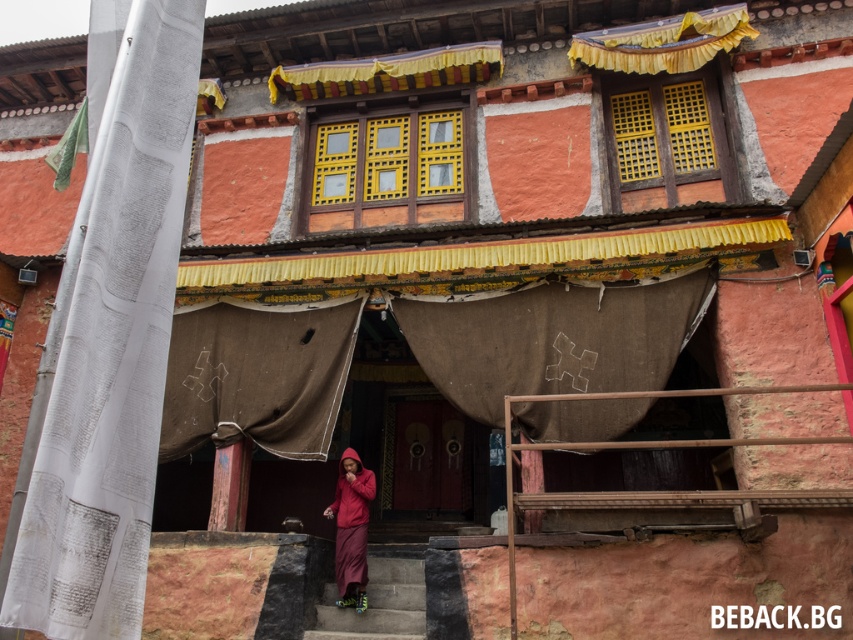
You are standing at the entrance of the traditional building and want to go down the concrete stairs at center. Based on the coordinates provided, which direction should you move relative to the building?

The concrete stairs at center are located at coordinates point (379, 598), so you should move towards the center of the building to reach them.

You are standing at the entrance of the traditional building and want to walk towards the two points marked in the scene. Which point, point (358, 621) or point (364, 529), would you reach first?

You would reach point (358, 621) first because it is in front of point (364, 529).